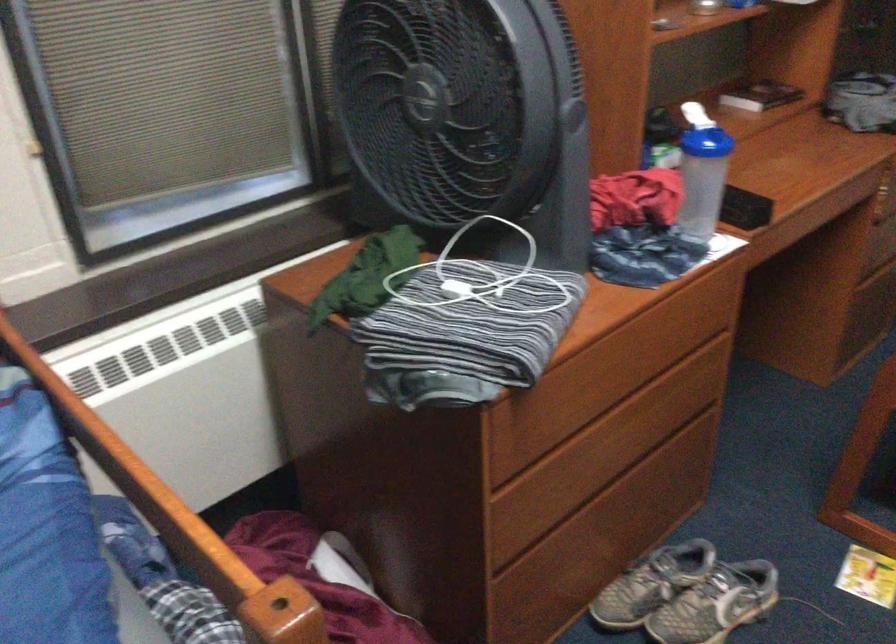
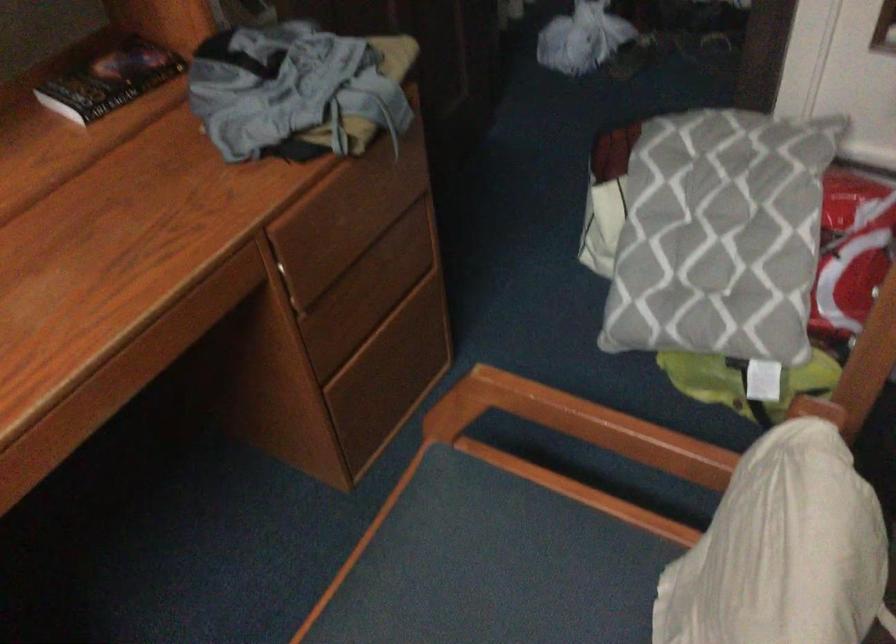
The point at (765, 86) is marked in the first image. Where is the corresponding point in the second image?

(110, 80)